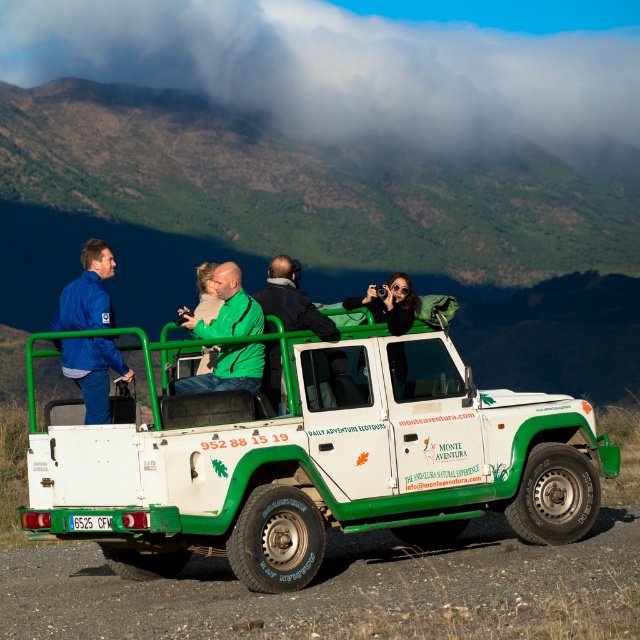
You are standing next to the camera and want to take a photo of the white matte jeep at center. If your camera has a maximum range of 10 meters, will you be able to capture the entire jeep in the photo?

The white matte jeep at center and camera are 10.99 meters apart from each other. Since the camera has a maximum range of 10 meters, you will not be able to capture the entire jeep in the photo as the distance exceeds the camera range.

You are a photographer standing in front of the white matte jeep at center and the blue matte jacket at left. Which object is positioned to the right side?

The white matte jeep at center is positioned to the right of the blue matte jacket at left.

You are a photographer trying to capture a clear shot of the green matte vehicle at center and the green matte jacket at center. Since you want to focus on both objects, which one should you zoom in on first to ensure the larger object is in focus?

The green matte vehicle at center is larger than the green matte jacket at center, so you should zoom in on the green matte vehicle at center first to ensure it is in focus before adjusting for the smaller object.